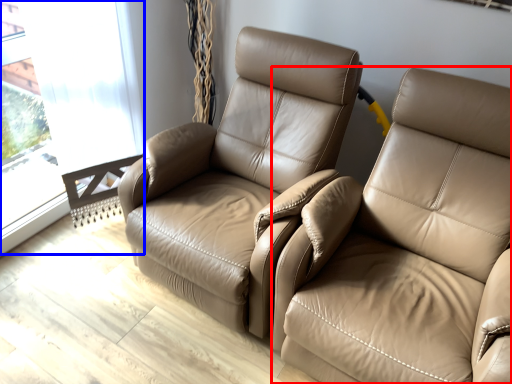
Question: Which point is closer to the camera, studio couch (highlighted by a red box) or window (highlighted by a blue box)?

Choices:
 (A) studio couch
 (B) window

Answer: (A)